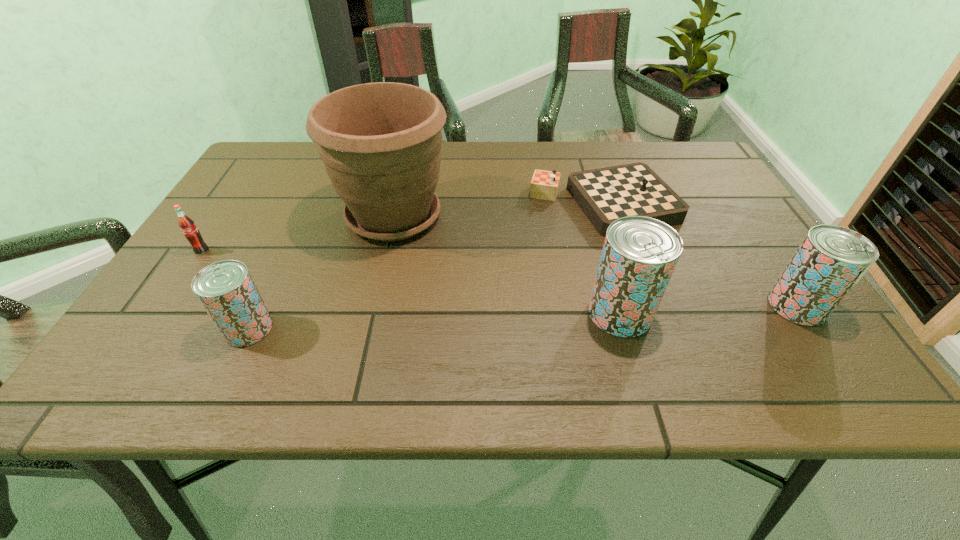
Please point a location where one more beer_can can be added evenly. Please provide its 2D coordinates. Your answer should be formatted as a tuple, i.e. [(x, y)], where the tuple contains the x and y coordinates of a point satisfying the conditions above.

[(437, 321)]